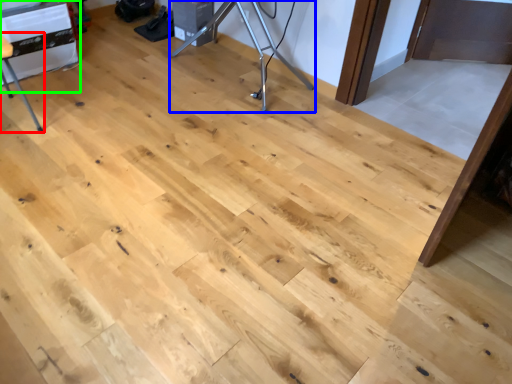
Question: Which object is the closest to the furniture (highlighted by a red box)? Choose among these: tripod (highlighted by a blue box) or table (highlighted by a green box).

Choices:
 (A) tripod
 (B) table

Answer: (B)